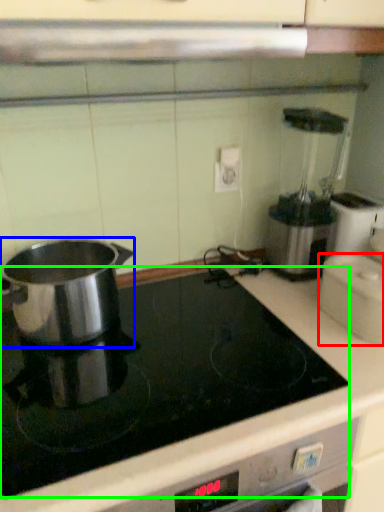
Question: Which is nearer to the kitchen appliance (highlighted by a red box)? kitchen appliance (highlighted by a blue box) or kitchen appliance (highlighted by a green box).

Choices:
 (A) kitchen appliance
 (B) kitchen appliance

Answer: (B)